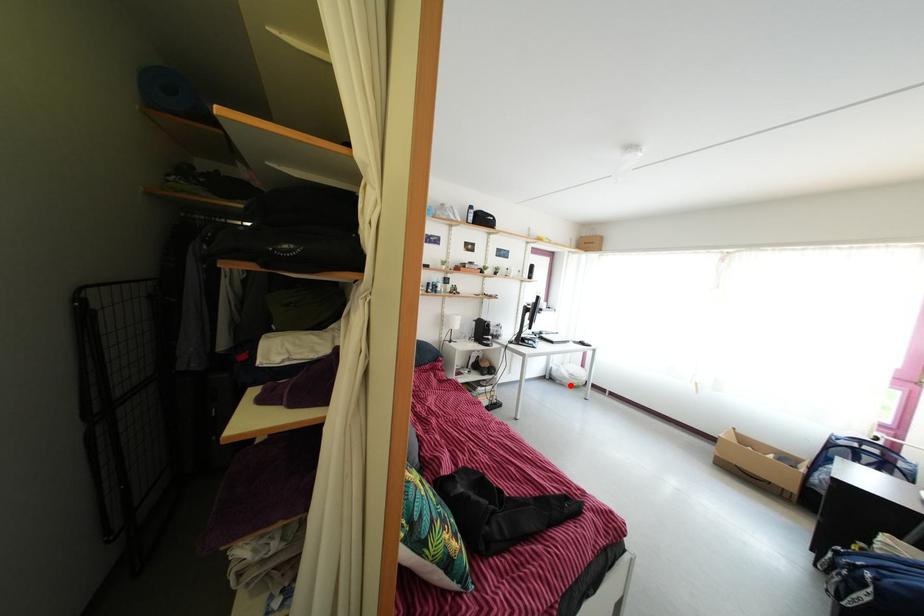
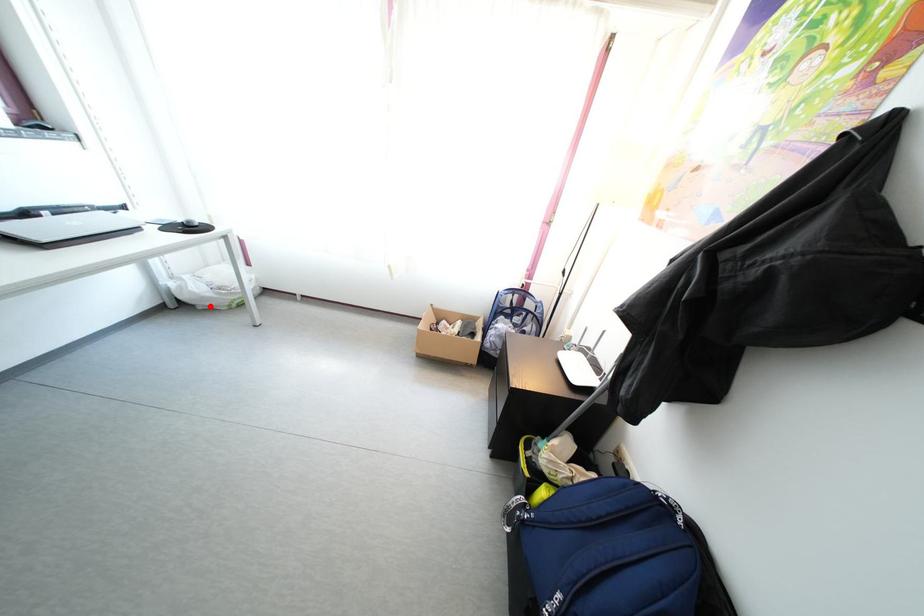
I am providing you with two images of the same scene from different viewpoints. A red point is marked on the first image and another point is marked on the second image. Does the point marked in image1 correspond to the same location as the one in image2?

Yes